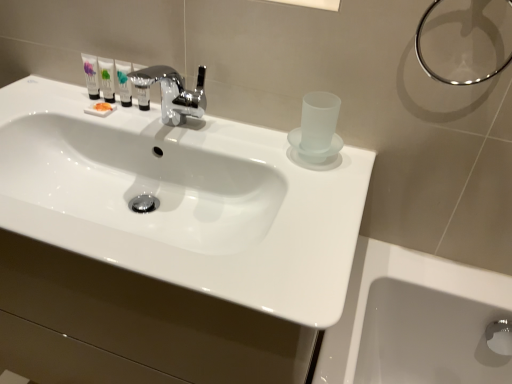
Question: Is matte white tube at upper left, the 1th mouthwash positioned from the left, inside or outside of metallic ring at upper right?

Choices:
 (A) inside
 (B) outside

Answer: (B)

Question: From the image's perspective, is matte white tube at upper left, the fourth mouthwash viewed from the right, above or below metallic ring at upper right?

Choices:
 (A) above
 (B) below

Answer: (A)

Question: Considering the real-world distances, which object is closest to the metallic ring at upper right?

Choices:
 (A) matte white tube at upper left, the fourth mouthwash viewed from the right
 (B) matte white tube at upper left, the 2th mouthwash from the left
 (C) white glossy sink at center
 (D) satin silver bottle at center, which ranks as the 4th mouthwash in left-to-right order
 (E) translucent plastic tube at upper center, which is the 2th mouthwash in right-to-left order

Answer: (C)

Question: Which object is positioned farthest from the metallic ring at upper right?

Choices:
 (A) satin silver bottle at center, which ranks as the 4th mouthwash in left-to-right order
 (B) matte white tube at upper left, the 2th mouthwash from the left
 (C) matte white tube at upper left, the fourth mouthwash viewed from the right
 (D) translucent plastic tube at upper center, the 3th mouthwash viewed from the left
 (E) white glossy sink at center

Answer: (C)